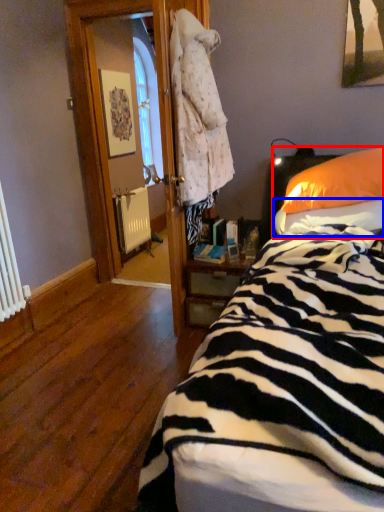
Question: Among these objects, which one is farthest to the camera, pillow (highlighted by a red box) or sheet (highlighted by a blue box)?

Choices:
 (A) pillow
 (B) sheet

Answer: (A)